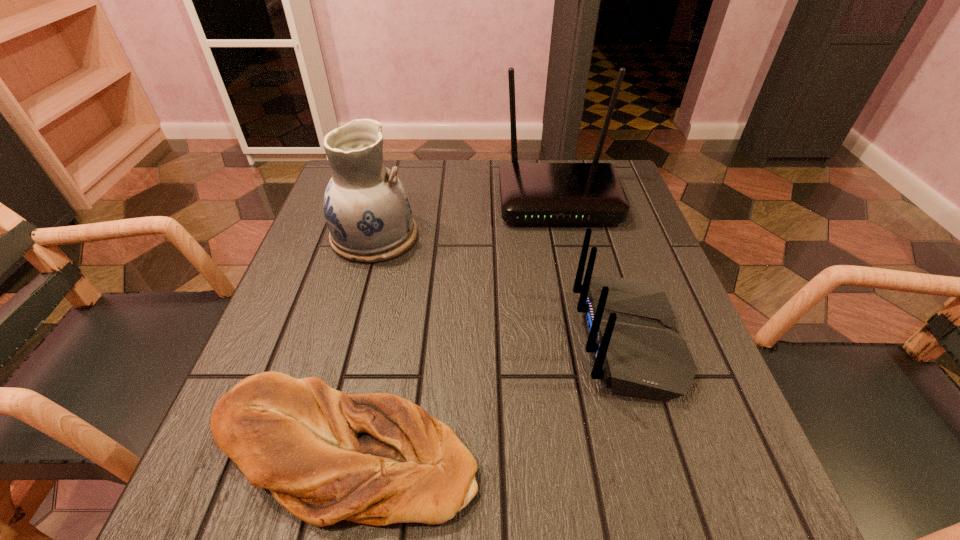
You are a GUI agent. You are given a task and a screenshot of the screen. Output one action in this format:
    pyautogui.click(x=<x>, y=<y>)
    Task: Click on the free space located on the right of the shortest object
    
    Given the screenshot: What is the action you would take?
    pyautogui.click(x=633, y=451)

Image resolution: width=960 pixels, height=540 pixels. In order to click on object located in the far edge section of the desktop in this screenshot , I will do `click(530, 192)`.

The height and width of the screenshot is (540, 960). In order to click on object that is at the near edge in this screenshot , I will do `click(377, 459)`.

Locate an element on the screen. Image resolution: width=960 pixels, height=540 pixels. pottery situated at the left edge is located at coordinates (366, 207).

You are a GUI agent. You are given a task and a screenshot of the screen. Output one action in this format:
    pyautogui.click(x=<x>, y=<y>)
    Task: Click on the bread that is at the left edge
    The width and height of the screenshot is (960, 540).
    Given the screenshot: What is the action you would take?
    pyautogui.click(x=377, y=459)

Locate an element on the screen. The image size is (960, 540). object positioned at the near left corner is located at coordinates (377, 459).

Identify the location of object positioned at the far right corner. The width and height of the screenshot is (960, 540). (530, 192).

Identify the location of free region at the far edge of the desktop. The height and width of the screenshot is (540, 960). [x=524, y=161].

Image resolution: width=960 pixels, height=540 pixels. In the image, there is a desktop. In order to click on free space at the left edge in this screenshot , I will do `click(341, 282)`.

This screenshot has width=960, height=540. What are the coordinates of `free region at the right edge of the desktop` in the screenshot? It's located at [x=661, y=284].